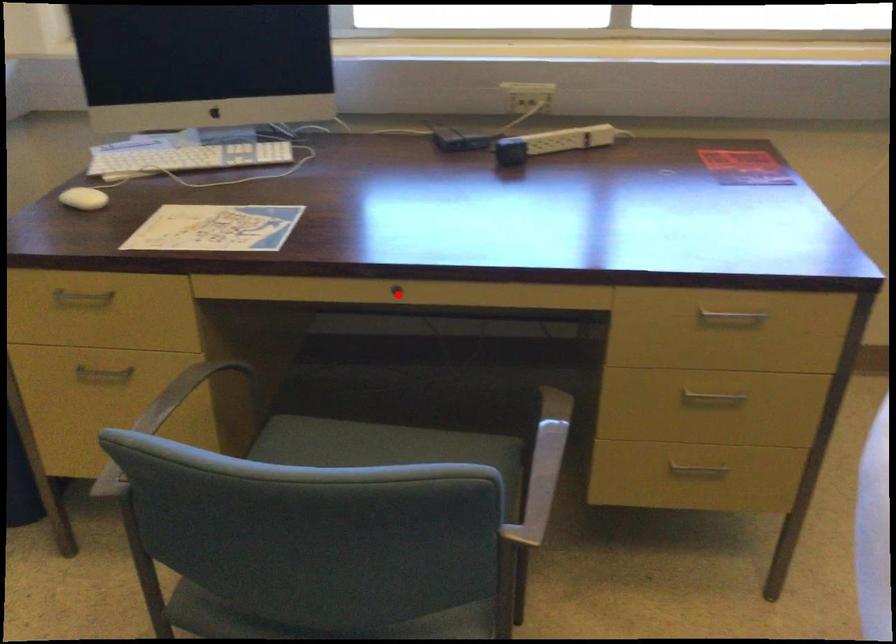
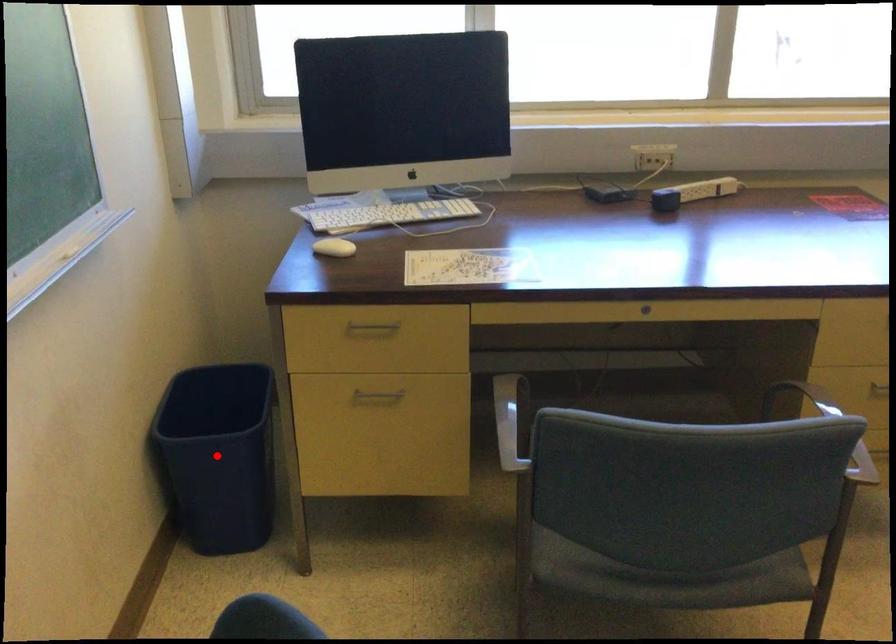
Looking at this image, I am providing you with two images of the same scene from different viewpoints. A red point is marked on the first image and another point is marked on the second image. Is the red point in image1 aligned with the point shown in image2?

No